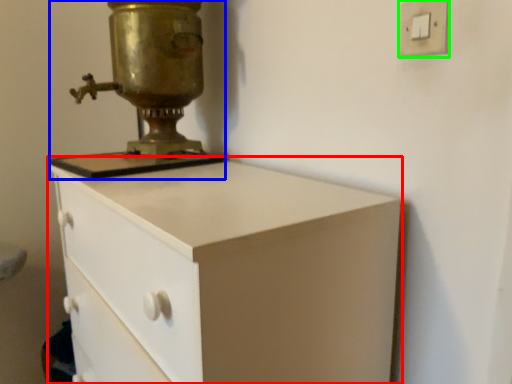
Question: Estimate the real-world distances between objects in this image. Which object is closer to chest of drawers (highlighted by a red box), sewing machine (highlighted by a blue box) or light switch (highlighted by a green box)?

Choices:
 (A) sewing machine
 (B) light switch

Answer: (A)